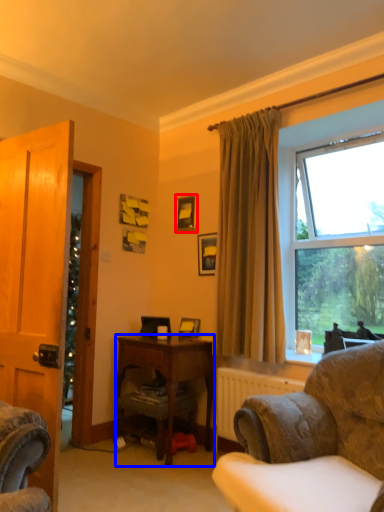
Question: Among these objects, which one is farthest to the camera, picture frame (highlighted by a red box) or desk (highlighted by a blue box)?

Choices:
 (A) picture frame
 (B) desk

Answer: (A)